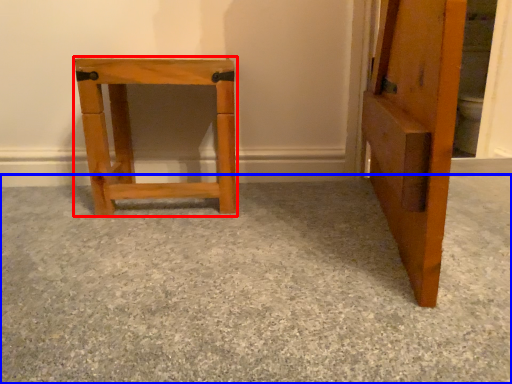
Question: Which of the following is the farthest to the observer, furniture (highlighted by a red box) or concrete (highlighted by a blue box)?

Choices:
 (A) furniture
 (B) concrete

Answer: (A)